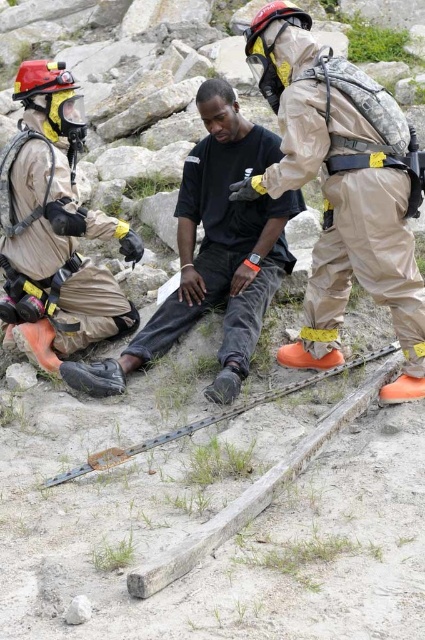
Who is taller, tan protective suit at center or metal chain at center?

tan protective suit at center is taller.

Is tan protective suit at center positioned behind metal chain at center?

Yes, tan protective suit at center is further from the viewer.

Is point (363, 141) positioned in front of point (84, 465)?

That is False.

You are a GUI agent. You are given a task and a screenshot of the screen. Output one action in this format:
    pyautogui.click(x=<x>, y=<y>)
    Task: Click on the tan protective suit at center
    The image size is (425, 640).
    Given the screenshot: What is the action you would take?
    pyautogui.click(x=342, y=188)

Between point (235, 140) and point (33, 304), which one is positioned in front?

Positioned in front is point (33, 304).

Where is `black cotton shirt at center`? Image resolution: width=425 pixels, height=640 pixels. black cotton shirt at center is located at coordinates (212, 253).

Does point (238, 339) lie behind point (51, 227)?

No.

This screenshot has width=425, height=640. I want to click on black cotton shirt at center, so click(212, 253).

Can you confirm if tan protective suit at center is bigger than tan protective suit at left?

Indeed, tan protective suit at center has a larger size compared to tan protective suit at left.

Is tan protective suit at center smaller than tan protective suit at left?

Actually, tan protective suit at center might be larger than tan protective suit at left.

Where is `tan protective suit at center`? The height and width of the screenshot is (640, 425). tan protective suit at center is located at coordinates (342, 188).

At what (x,y) coordinates should I click in order to perform the action: click on tan protective suit at center. Please return your answer as a coordinate pair (x, y). Image resolution: width=425 pixels, height=640 pixels. Looking at the image, I should click on (342, 188).